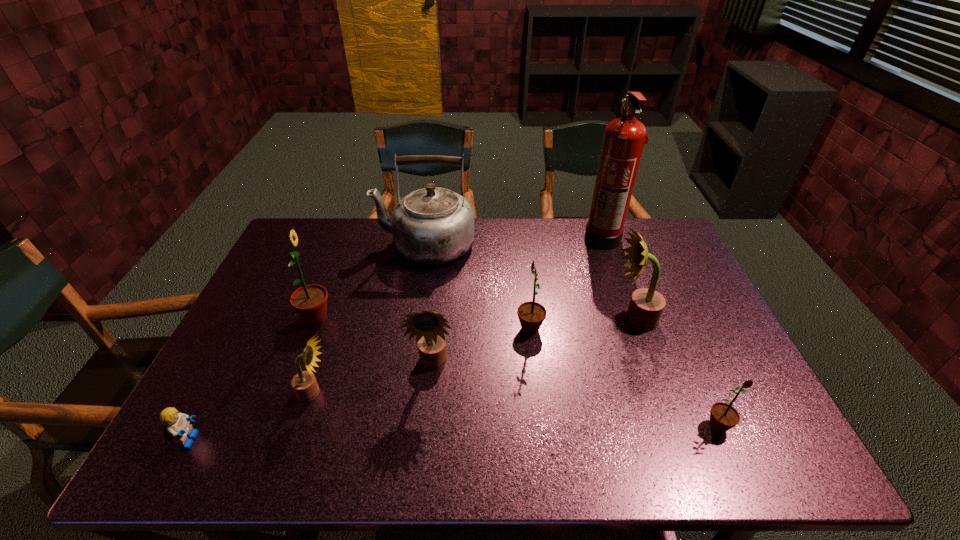
You are a GUI agent. You are given a task and a screenshot of the screen. Output one action in this format:
    pyautogui.click(x=<x>, y=<y>)
    Task: Click on the free spot between the biggest yellow sunflower and the second yellow sunflower from right to left
    This screenshot has height=540, width=960.
    Given the screenshot: What is the action you would take?
    pyautogui.click(x=534, y=342)

Find the location of a particular element. This screenshot has width=960, height=540. free spot between the leftmost yellow sunflower and the second sunflower from right to left is located at coordinates (474, 356).

You are a GUI agent. You are given a task and a screenshot of the screen. Output one action in this format:
    pyautogui.click(x=<x>, y=<y>)
    Task: Click on the free space between the rightmost object and the leftmost yellow sunflower
    This screenshot has height=540, width=960.
    Given the screenshot: What is the action you would take?
    pyautogui.click(x=516, y=409)

This screenshot has height=540, width=960. I want to click on vacant area between the tallest object and the leftmost green sunflower, so click(x=459, y=278).

At what (x,y) coordinates should I click in order to perform the action: click on free spot between the second yellow sunflower from right to left and the second biggest green sunflower. Please return your answer as a coordinate pair (x, y). Looking at the image, I should click on (482, 347).

Image resolution: width=960 pixels, height=540 pixels. I want to click on object that is the third closest to the rightmost sunflower, so click(x=428, y=327).

Locate which object is the third closest to the second biggest yellow sunflower. Please provide its 2D coordinates. Your answer should be formatted as a tuple, i.e. [(x, y)], where the tuple contains the x and y coordinates of a point satisfying the conditions above.

[(310, 301)]

Where is `sunflower that stands as the third closest to the second green sunflower from right to left`? This screenshot has width=960, height=540. sunflower that stands as the third closest to the second green sunflower from right to left is located at coordinates pos(723,416).

I want to click on the fifth closest sunflower relative to the biggest green sunflower, so click(x=723, y=416).

Locate an element on the screen. yellow sunflower object that ranks as the third closest to the leftmost green sunflower is located at coordinates (646, 306).